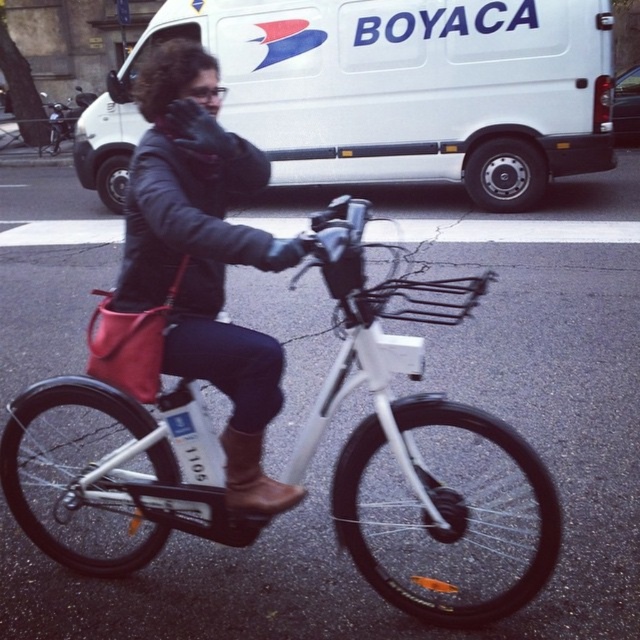
Question: Observing the image, what is the correct spatial positioning of white matte bicycle at center in reference to white matte van at upper center?

Choices:
 (A) above
 (B) below

Answer: (B)

Question: Considering the real-world distances, which object is closest to the white matte van at upper center?

Choices:
 (A) brown leather boot at center
 (B) leather jacket at center
 (C) white matte bicycle at center

Answer: (B)

Question: Among these objects, which one is nearest to the camera?

Choices:
 (A) white matte van at upper center
 (B) brown leather boot at center

Answer: (B)

Question: Does white matte van at upper center have a smaller size compared to brown leather boot at center?

Choices:
 (A) no
 (B) yes

Answer: (B)

Question: Which point is farther to the camera?

Choices:
 (A) white matte bicycle at center
 (B) leather jacket at center

Answer: (A)

Question: Observing the image, what is the correct spatial positioning of white matte bicycle at center in reference to white matte van at upper center?

Choices:
 (A) right
 (B) left

Answer: (A)